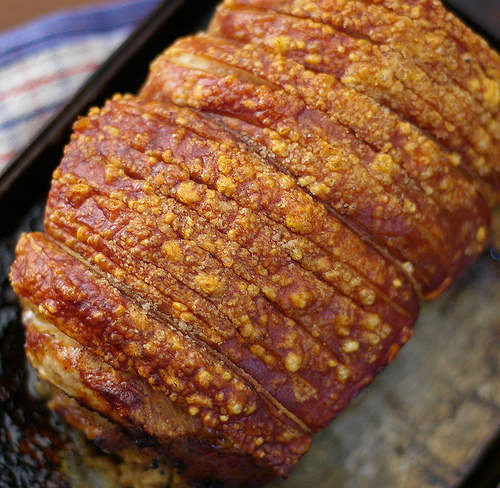
You are a GUI agent. You are given a task and a screenshot of the screen. Output one action in this format:
    pyautogui.click(x=<x>, y=<y>)
    Task: Click on the rim of roasting pan
    Image resolution: width=500 pixels, height=488 pixels.
    Given the screenshot: What is the action you would take?
    pyautogui.click(x=112, y=64)